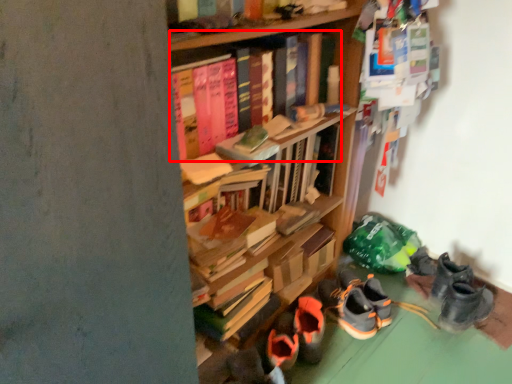
Question: Where is book (annotated by the red box) located in relation to footwear in the image?

Choices:
 (A) left
 (B) right

Answer: (A)